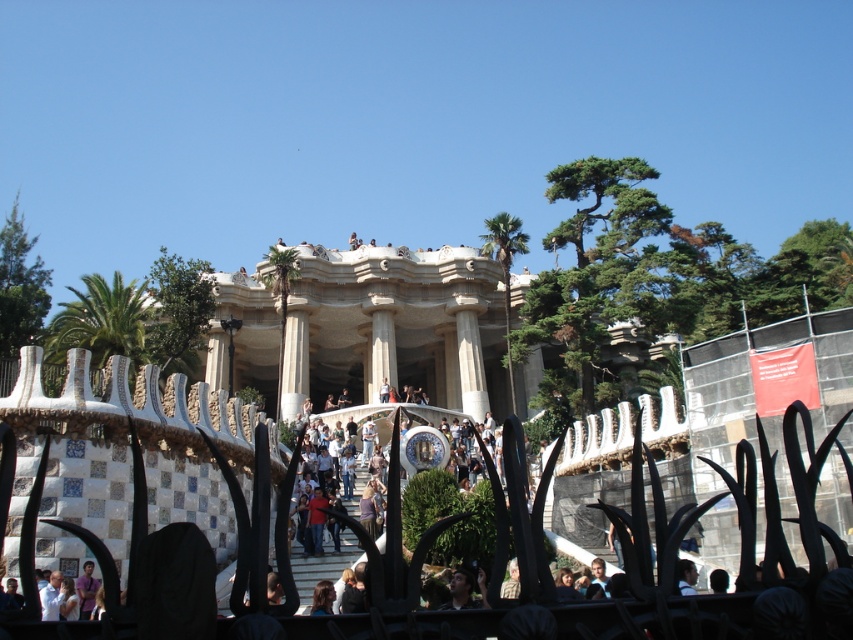
Is white stone palace at center behind dark brown hair at center?

Yes, white stone palace at center is further from the viewer.

Does white stone palace at center appear over dark brown hair at center?

Yes, white stone palace at center is above dark brown hair at center.

At what (x,y) coordinates should I click in order to perform the action: click on white stone palace at center. Please return your answer as a coordinate pair (x, y). This screenshot has height=640, width=853. Looking at the image, I should click on (373, 330).

What are the coordinates of `white stone palace at center` in the screenshot? It's located at (373, 330).

Which is above, white stone palace at center or dark brown leather jacket at lower center?

Positioned higher is white stone palace at center.

Is white stone palace at center below dark brown leather jacket at lower center?

No, white stone palace at center is not below dark brown leather jacket at lower center.

Is point (291, 291) behind point (679, 560)?

Yes, point (291, 291) is behind point (679, 560).

Identify the location of white stone palace at center. This screenshot has width=853, height=640. (373, 330).

Does dark brown hair at center have a larger size compared to dark brown leather jacket at lower center?

No, dark brown hair at center is not bigger than dark brown leather jacket at lower center.

Is dark brown hair at center positioned at the back of dark brown leather jacket at lower center?

Yes, dark brown hair at center is further from the viewer.

Image resolution: width=853 pixels, height=640 pixels. In order to click on dark brown hair at center in this screenshot , I will do `click(465, 589)`.

The height and width of the screenshot is (640, 853). In order to click on dark brown hair at center in this screenshot , I will do `click(465, 589)`.